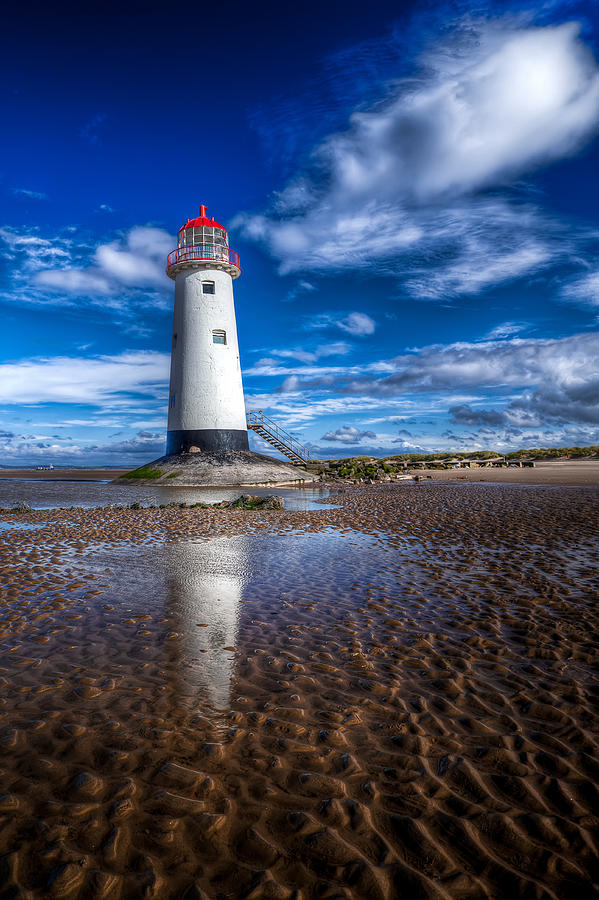
This screenshot has height=900, width=599. I want to click on windows, so click(208, 288), click(220, 338).